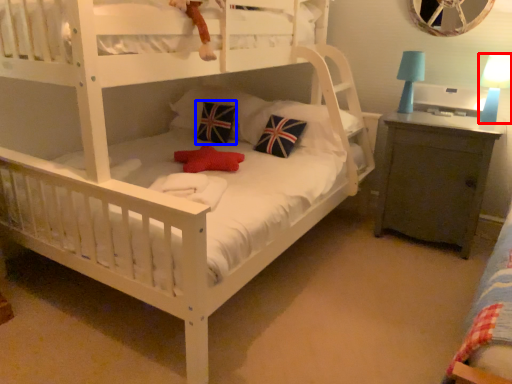
Question: Which object appears farthest to the camera in this image, table lamp (highlighted by a red box) or pillow (highlighted by a blue box)?

Choices:
 (A) table lamp
 (B) pillow

Answer: (B)